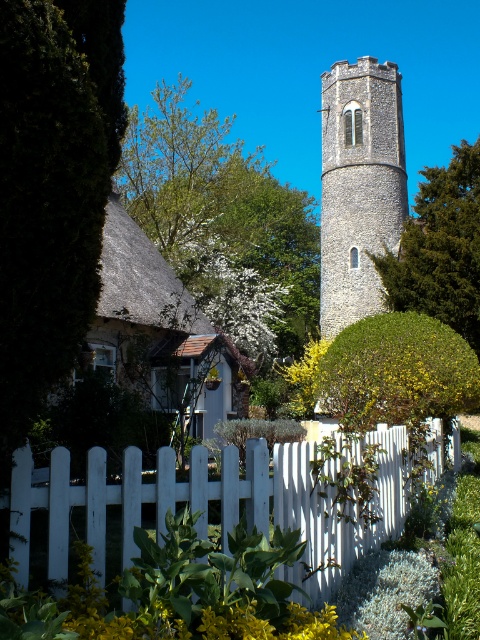
From the picture: Between yellow matte flower at lower center and yellow matte flower at center, which one is positioned lower?

yellow matte flower at lower center is lower down.

Who is more distant from viewer, (70, 630) or (280, 376)?

Point (280, 376)

Is point (33, 624) farther from viewer compared to point (305, 376)?

No, it is in front of (305, 376).

The image size is (480, 640). I want to click on yellow matte flower at lower center, so click(x=148, y=616).

Between white picket fence at lower center and green leafy tree at center, which one appears on the right side from the viewer's perspective?

green leafy tree at center

Between white picket fence at lower center and green leafy tree at center, which one has less height?

With less height is white picket fence at lower center.

This screenshot has width=480, height=640. I want to click on white picket fence at lower center, so click(226, 500).

Does dark green leafy tree at left have a larger size compared to stone tower at center?

Actually, dark green leafy tree at left might be smaller than stone tower at center.

In order to click on dark green leafy tree at left in this screenshot , I will do `click(51, 189)`.